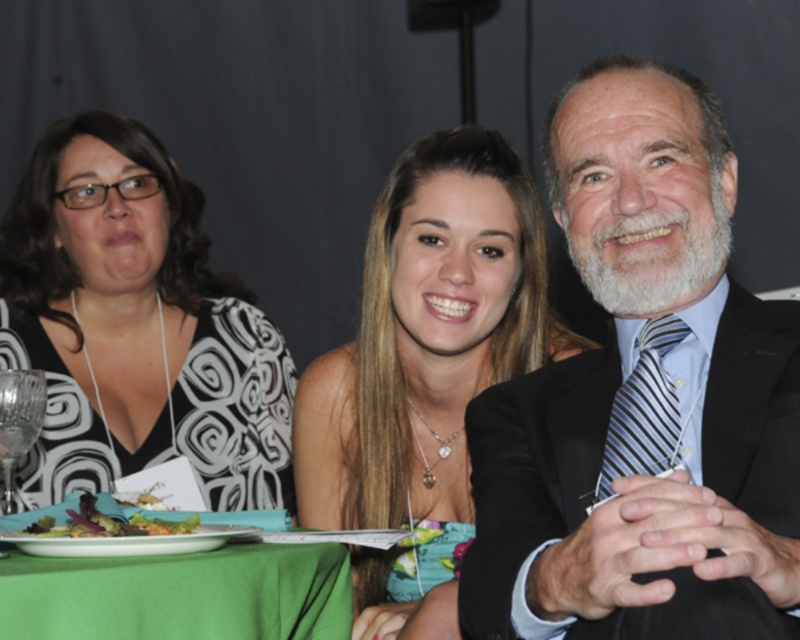
Question: Which object is the farthest from the green fabric table at lower left?

Choices:
 (A) black printed dress at left
 (B) white glossy plate at lower left
 (C) smooth brown hair at center

Answer: (A)

Question: Can you confirm if dark blue suit at right is positioned to the left of green leafy salad at lower left?

Choices:
 (A) no
 (B) yes

Answer: (A)

Question: Based on their relative distances, which object is nearer to the dark blue suit at right?

Choices:
 (A) black printed dress at left
 (B) smooth brown hair at center
 (C) white glossy plate at lower left
 (D) green fabric table at lower left

Answer: (D)

Question: Does black printed dress at left have a greater width compared to green leafy salad at lower left?

Choices:
 (A) yes
 (B) no

Answer: (A)

Question: Which of the following is the closest to the observer?

Choices:
 (A) (194, 420)
 (B) (300, 566)
 (C) (190, 541)

Answer: (C)

Question: Can you confirm if dark blue suit at right is positioned below green leafy salad at lower left?

Choices:
 (A) no
 (B) yes

Answer: (A)